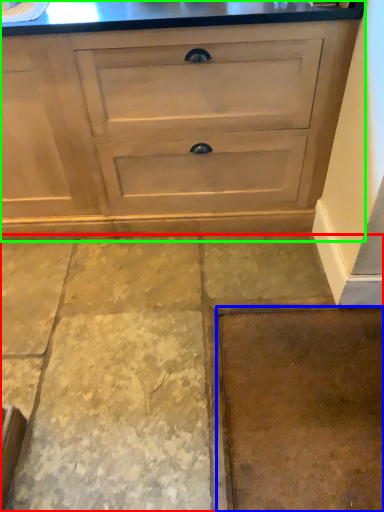
Question: Based on their relative distances, which object is farther from concrete (highlighted by a red box)? Choose from concrete (highlighted by a blue box) and chest of drawers (highlighted by a green box).

Choices:
 (A) concrete
 (B) chest of drawers

Answer: (B)